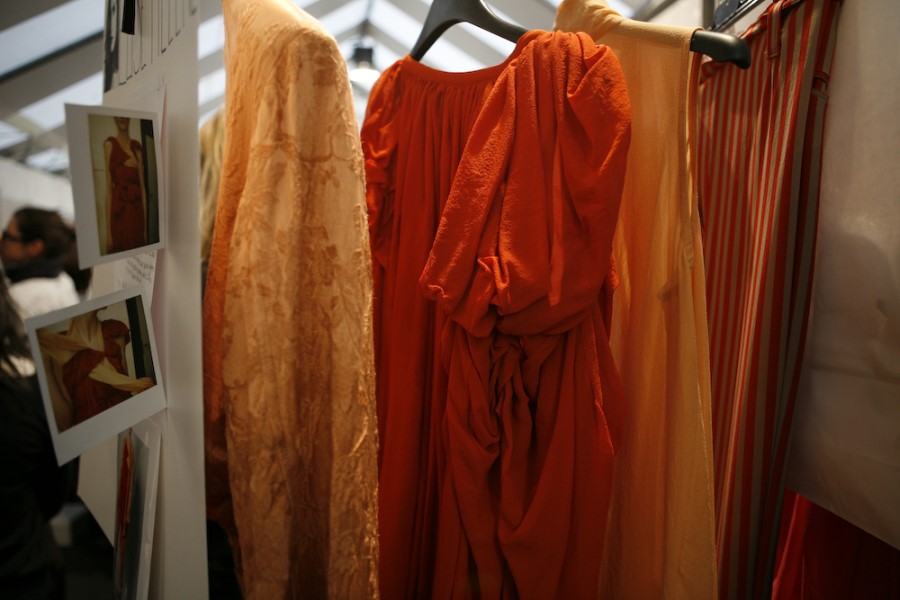
Where is `hangers`? This screenshot has width=900, height=600. hangers is located at coordinates (487, 20), (734, 54).